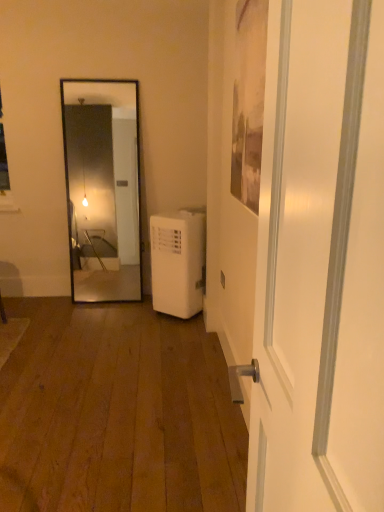
This screenshot has width=384, height=512. Find the location of `vacant space in front of white plastic air conditioner at lower right`. vacant space in front of white plastic air conditioner at lower right is located at coordinates (164, 331).